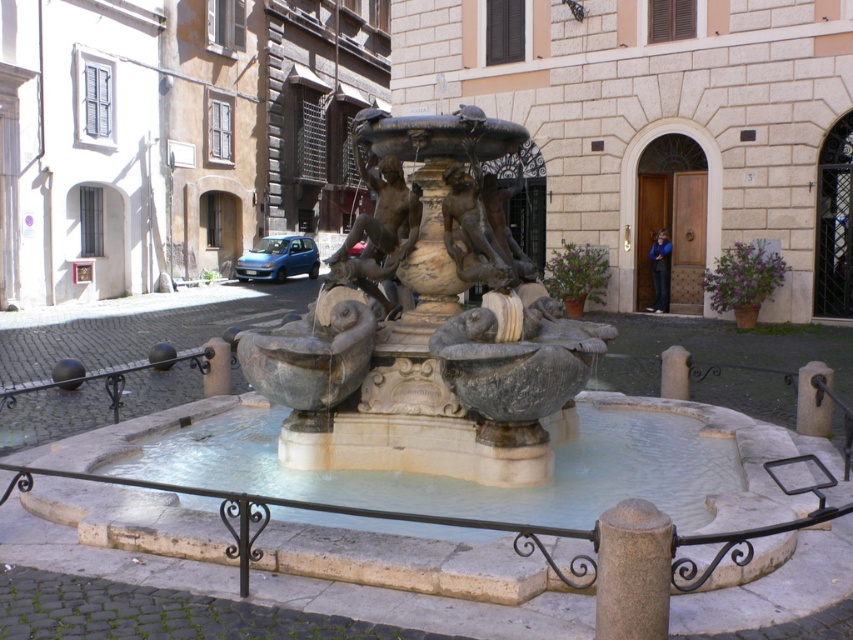
Can you confirm if bronze statue at center is shorter than granite post at lower center?

No, bronze statue at center is not shorter than granite post at lower center.

Does bronze statue at center have a smaller size compared to granite post at lower center?

Actually, bronze statue at center might be larger than granite post at lower center.

Locate an element on the screen. bronze statue at center is located at coordinates (433, 330).

Does granite post at lower center come in front of gray stone pillar at center?

Yes, it is in front of gray stone pillar at center.

Can you confirm if granite post at lower center is positioned to the left of gray stone pillar at center?

Indeed, granite post at lower center is positioned on the left side of gray stone pillar at center.

Image resolution: width=853 pixels, height=640 pixels. Describe the element at coordinates (633, 572) in the screenshot. I see `granite post at lower center` at that location.

I want to click on granite post at lower center, so click(x=633, y=572).

Can you confirm if bronze statue at center is positioned above gray stone pillar at center?

Yes, bronze statue at center is above gray stone pillar at center.

Who is positioned more to the right, bronze statue at center or gray stone pillar at center?

Positioned to the right is gray stone pillar at center.

This screenshot has width=853, height=640. I want to click on bronze statue at center, so click(433, 330).

The image size is (853, 640). Find the location of `bronze statue at center`. bronze statue at center is located at coordinates (433, 330).